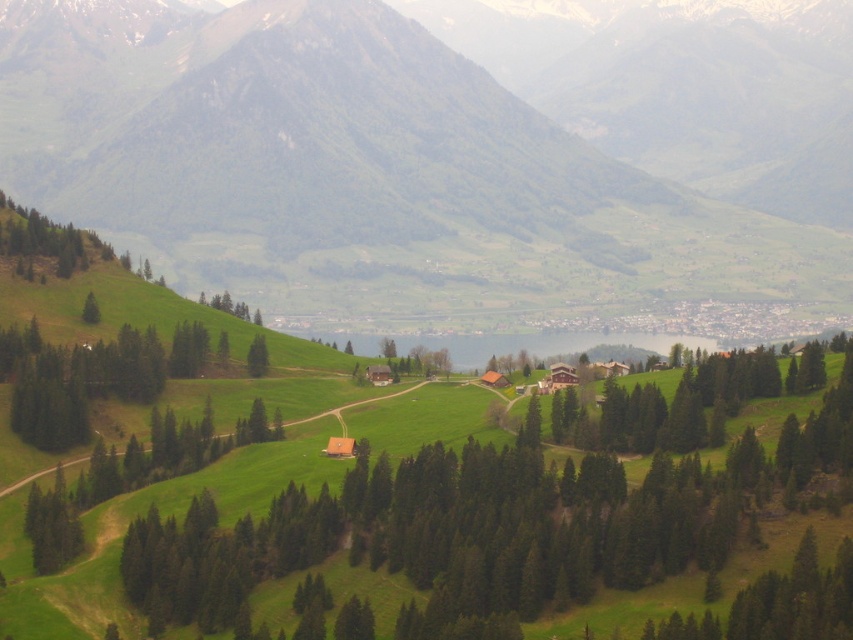
Question: Is green matte tree at center bigger than green matte tree at upper left?

Choices:
 (A) no
 (B) yes

Answer: (B)

Question: Which of the following is the farthest from the observer?

Choices:
 (A) green matte tree at center
 (B) green grassy hillside at center
 (C) green matte tree at upper left

Answer: (B)

Question: Which object appears farthest from the camera in this image?

Choices:
 (A) green matte tree at center
 (B) green matte tree at upper left

Answer: (A)

Question: Does green grassy hillside at center appear on the right side of green matte tree at upper left?

Choices:
 (A) no
 (B) yes

Answer: (B)

Question: Which of the following is the closest to the observer?

Choices:
 (A) green matte tree at center
 (B) green grassy hillside at center
 (C) green matte tree at upper left

Answer: (C)

Question: Does green grassy hillside at center have a smaller size compared to green matte tree at center?

Choices:
 (A) no
 (B) yes

Answer: (A)